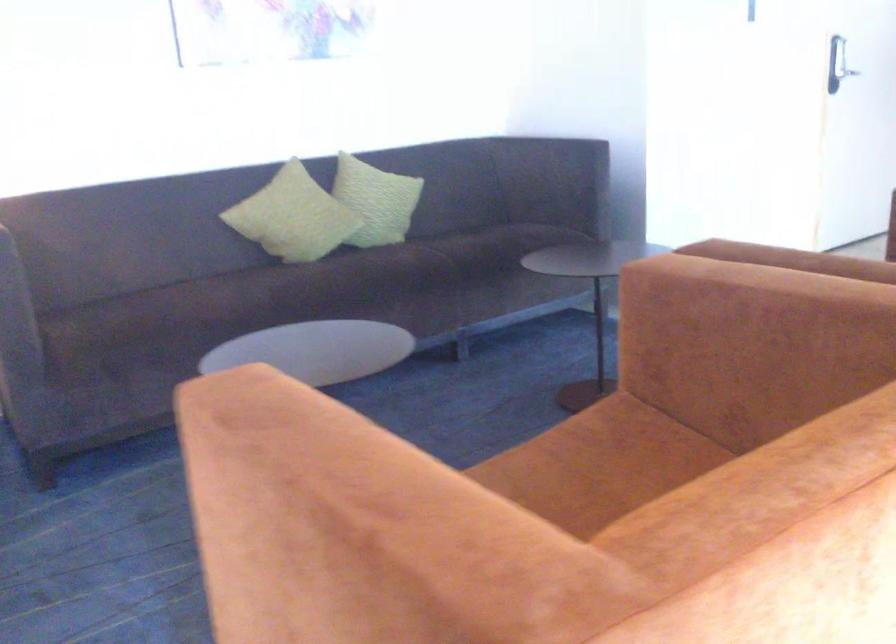
Where would you resting arm the orange sofa armrest? Please return your answer as a coordinate pair (x, y).

(782, 267)